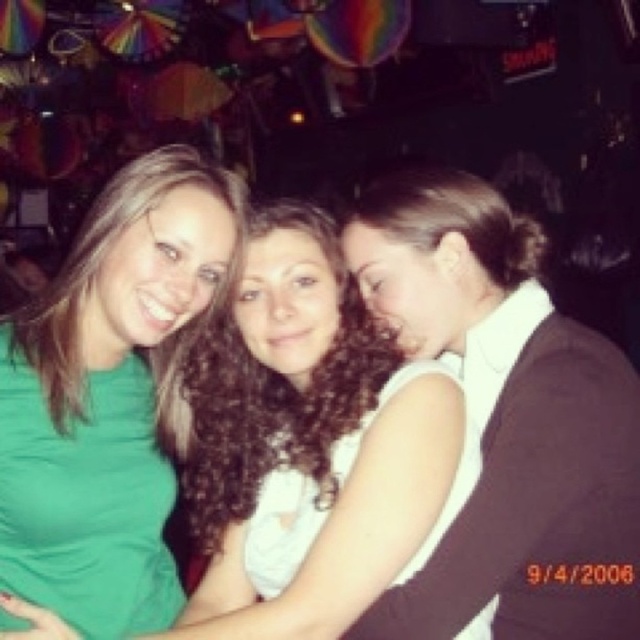
You are at a party and want to take a photo with the curly hair at center and the green matte shirt at left. Based on their sizes, which one should you focus on to ensure they both fit in the frame?

The curly hair at center is larger in size than the green matte shirt at left, so you should focus on the curly hair at center to ensure both fit in the frame.

You are taking a photo of three people standing close together. The person on the left is wearing a bright green top, the middle person has a white sleeveless top, and the person on the right has a dark top with a white collar. You notice a point at coordinates (308,444). What does this point represent?

The point at (308,444) represents curly hair at the center of the image.

You are standing in front of the three people in the image. The person with curly hair at center is 1.40 meters away from you. If you want to give them a high five, will you be able to reach them without moving closer?

The curly hair at center is 1.40 meters away from the viewer. Since the average arm length for a high five is about 1 meter, you would need to move closer to reach them.